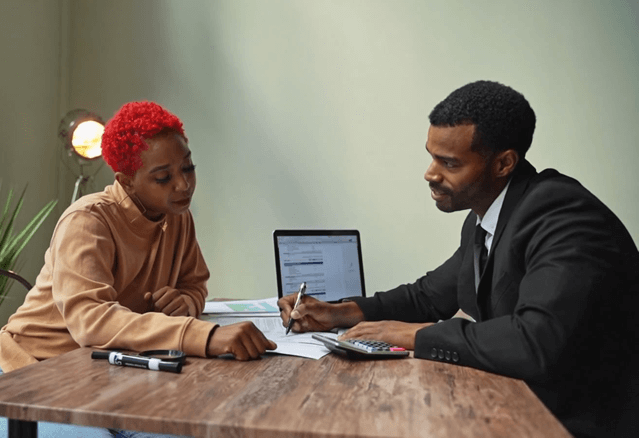
Image resolution: width=639 pixels, height=438 pixels. What are the coordinates of `light` in the screenshot? It's located at (82, 129).